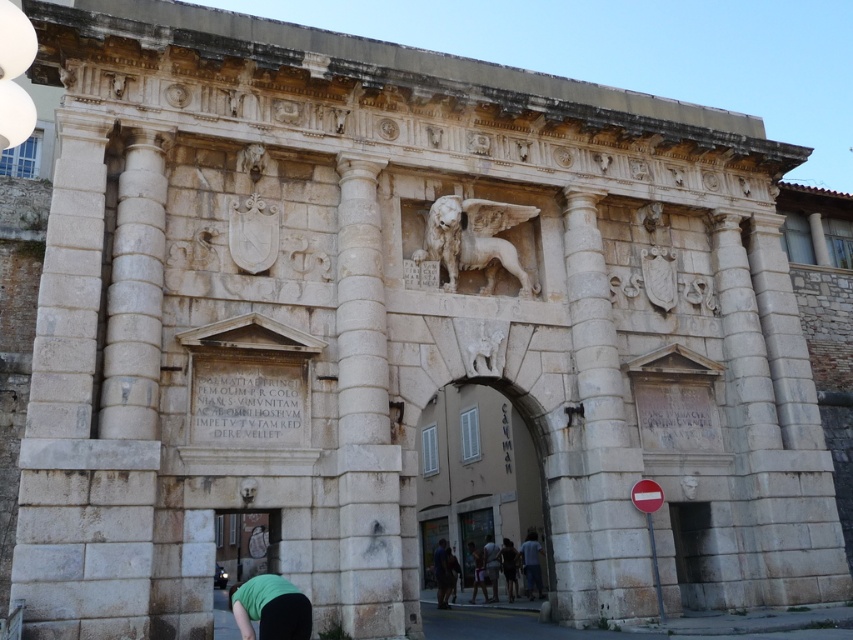
Question: Can you confirm if dark blue jeans at center is positioned below light gray fabric shirt at center?

Choices:
 (A) yes
 (B) no

Answer: (B)

Question: Is white stone winged lion at center positioned at the back of dark green fabric at center?

Choices:
 (A) yes
 (B) no

Answer: (B)

Question: Which of the following is the farthest from the observer?

Choices:
 (A) dark green fabric at center
 (B) green fabric at lower center

Answer: (A)

Question: Which of the following is the closest to the observer?

Choices:
 (A) (268, 589)
 (B) (531, 589)
 (C) (508, 554)

Answer: (A)

Question: Based on their relative distances, which object is nearer to the green fabric at lower center?

Choices:
 (A) white stone column at right
 (B) green fabric person at lower center

Answer: (B)

Question: Does white stone column at center appear on the left side of green fabric shirt at center?

Choices:
 (A) no
 (B) yes

Answer: (B)